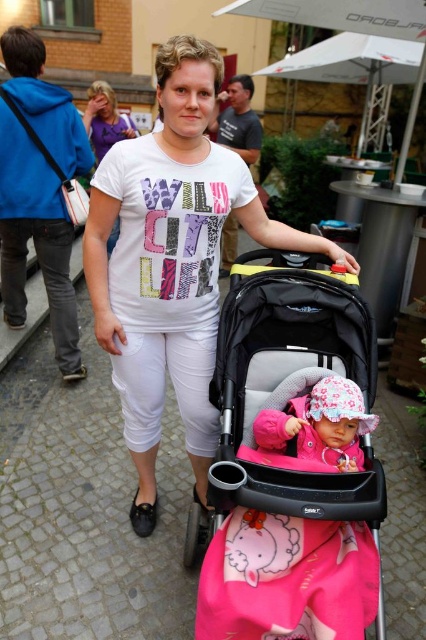
Question: Is cobblestone pavement at center thinner than dark gray t-shirt at upper center?

Choices:
 (A) yes
 (B) no

Answer: (B)

Question: Which object is closer to the camera taking this photo?

Choices:
 (A) pink fabric baby at center
 (B) black plastic baby carriage at center
 (C) brushed metal bag at left
 (D) cobblestone pavement at center

Answer: (B)

Question: From the image, what is the correct spatial relationship of brushed metal bag at left in relation to dark gray t-shirt at upper center?

Choices:
 (A) above
 (B) below

Answer: (B)

Question: Among these points, which one is farthest from the camera?

Choices:
 (A) (20, 58)
 (B) (330, 385)
 (C) (336, 522)
 (D) (101, 124)

Answer: (D)

Question: Which of these objects is positioned closest to the dark gray t-shirt at upper center?

Choices:
 (A) cobblestone pavement at center
 (B) white matte t-shirt at center
 (C) brushed metal bag at left
 (D) pink fabric baby at center

Answer: (B)

Question: Is cobblestone pavement at center to the right of white matte t-shirt at center from the viewer's perspective?

Choices:
 (A) no
 (B) yes

Answer: (B)